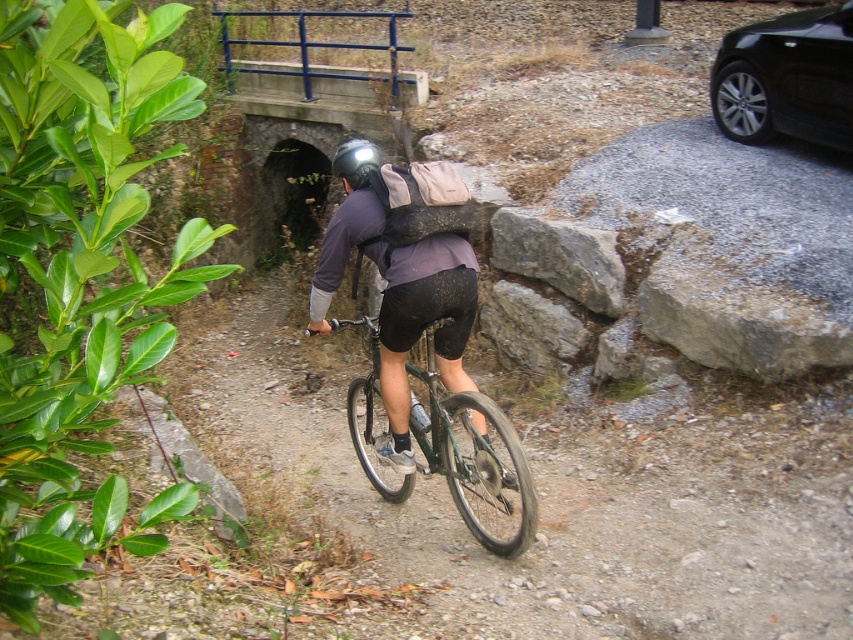
Does green matte bicycle at center appear on the left side of matte black helmet at center?

Incorrect, green matte bicycle at center is not on the left side of matte black helmet at center.

Locate an element on the screen. The height and width of the screenshot is (640, 853). green matte bicycle at center is located at coordinates (474, 460).